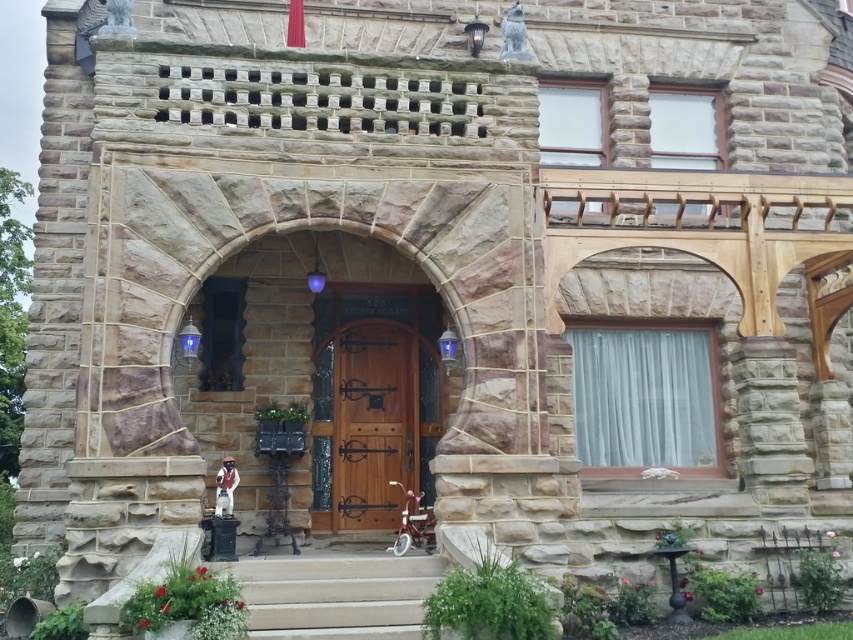
Question: Can you confirm if wooden door at center is bigger than smooth concrete stairs at lower center?

Choices:
 (A) no
 (B) yes

Answer: (B)

Question: Which of the following is the farthest from the observer?

Choices:
 (A) smooth concrete stairs at lower center
 (B) wooden door at center

Answer: (B)

Question: Can you confirm if wooden door at center is bigger than smooth concrete stairs at lower center?

Choices:
 (A) no
 (B) yes

Answer: (B)

Question: Observing the image, what is the correct spatial positioning of wooden door at center in reference to smooth concrete stairs at lower center?

Choices:
 (A) left
 (B) right

Answer: (A)

Question: Which of the following is the closest to the observer?

Choices:
 (A) (434, 573)
 (B) (410, 449)

Answer: (A)

Question: Which point is farther to the camera?

Choices:
 (A) (364, 628)
 (B) (379, 499)

Answer: (B)